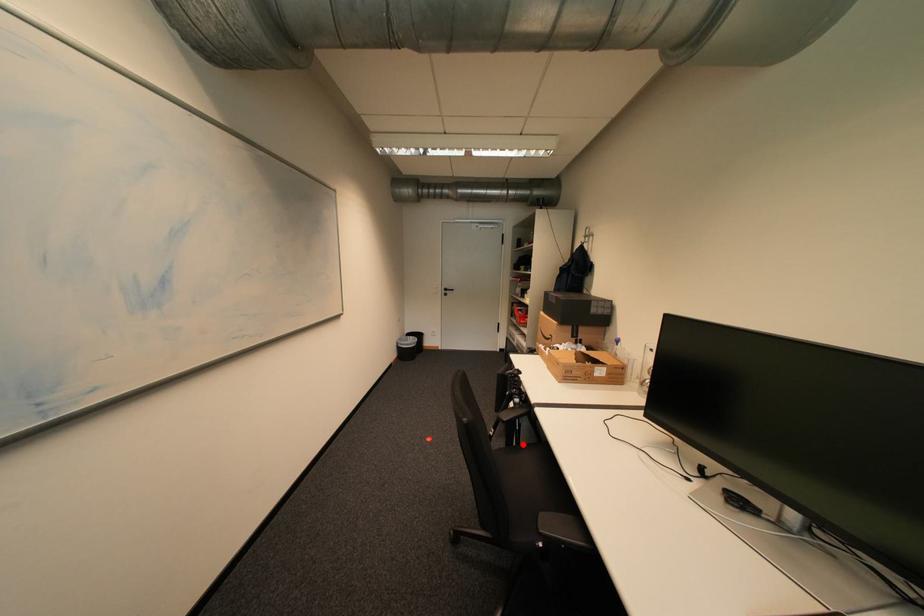
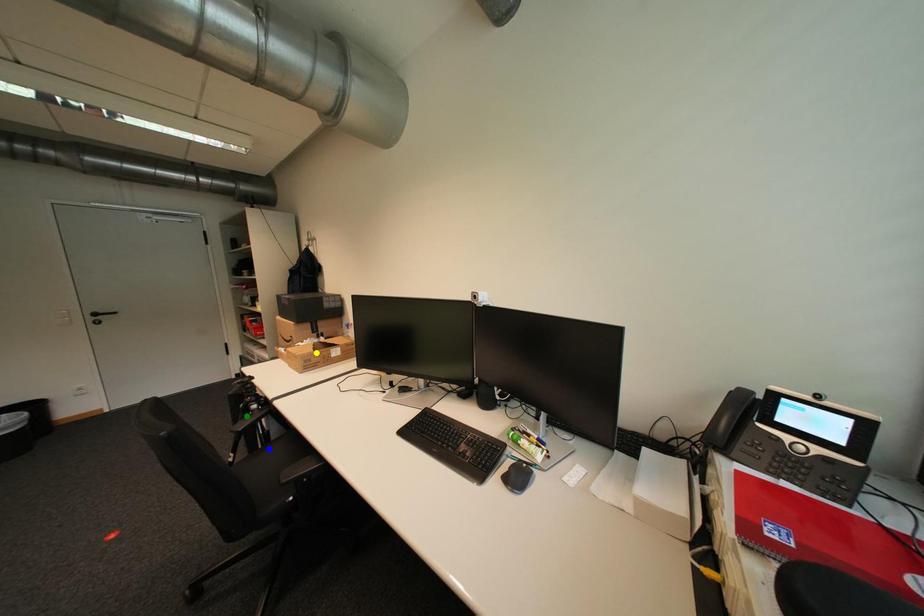
Question: I am providing you with two images of the same scene from different viewpoints. A red point is marked on the first image. You are given multiple points on the second image. Can you choose the point in image 2 that corresponds to the point in image 1?

Choices:
 (A) green point
 (B) blue point
 (C) yellow point

Answer: (B)